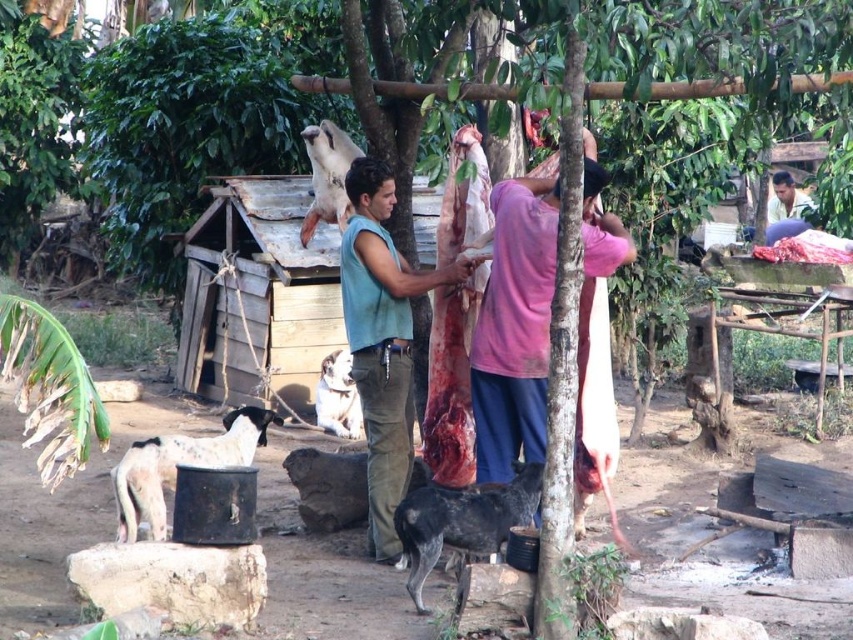
Question: From the image, what is the correct spatial relationship of white fur dog at upper center in relation to smooth skin man at upper right?

Choices:
 (A) above
 (B) below

Answer: (B)

Question: Can you confirm if spotted fur dog at lower center is bigger than smooth skin man at upper right?

Choices:
 (A) no
 (B) yes

Answer: (A)

Question: Based on their relative distances, which object is nearer to the white fur dog at upper center?

Choices:
 (A) smooth skin man at upper right
 (B) teal sleeveless shirt at center
 (C) spotted fur dog at lower center

Answer: (B)

Question: Which point is farther to the camera?

Choices:
 (A) (163, 456)
 (B) (323, 180)
 (C) (795, 196)
 (D) (344, 420)

Answer: (C)

Question: Which point is farther from the camera taking this photo?

Choices:
 (A) (325, 211)
 (B) (392, 520)
 (C) (521, 499)

Answer: (A)

Question: Can you confirm if pink cotton shirt at center is thinner than spotted fur dog at lower center?

Choices:
 (A) yes
 (B) no

Answer: (B)